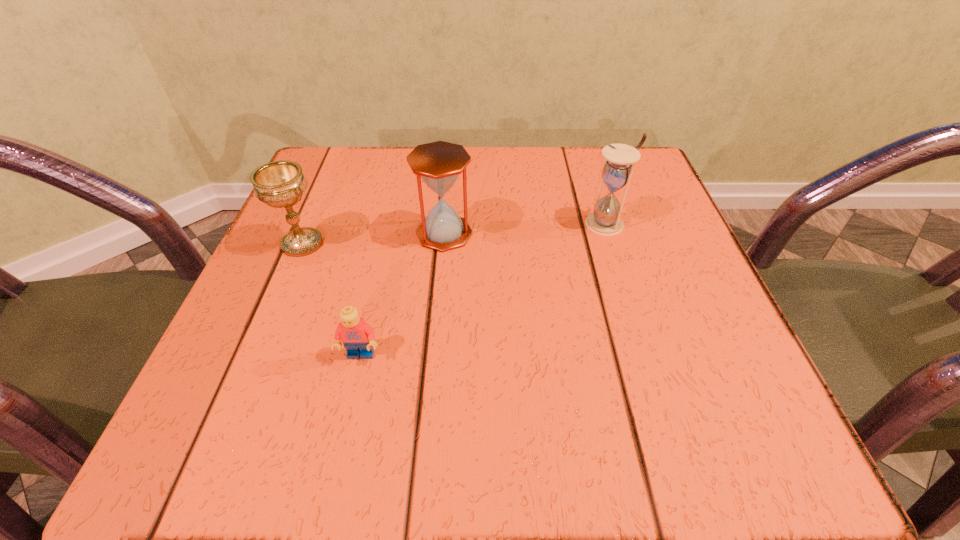
Identify the location of object that stands as the second closest to the left hourglass. The image size is (960, 540). (357, 336).

Identify which object is the closest to the right hourglass. Please provide its 2D coordinates. Your answer should be formatted as a tuple, i.e. [(x, y)], where the tuple contains the x and y coordinates of a point satisfying the conditions above.

[(438, 164)]